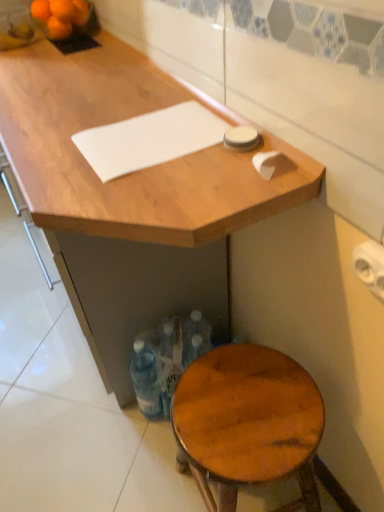
The height and width of the screenshot is (512, 384). I want to click on free area in between white matte cutting board at upper center and orange matte tangerine at upper left, which is the first tangerine from front to back, so click(100, 83).